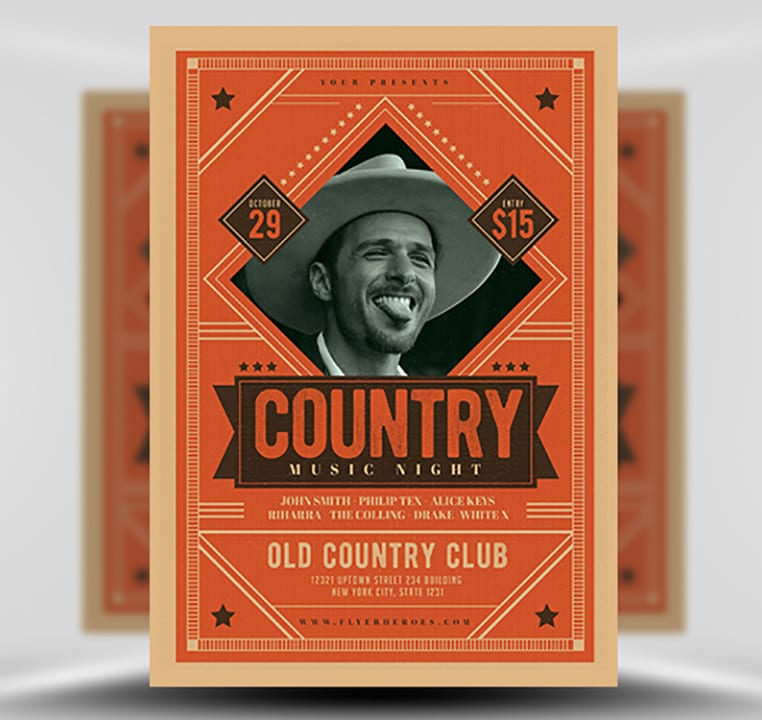
This screenshot has height=720, width=762. In order to click on view of left side of poster behind main graphic poster in this screenshot , I will do `click(648, 399)`.